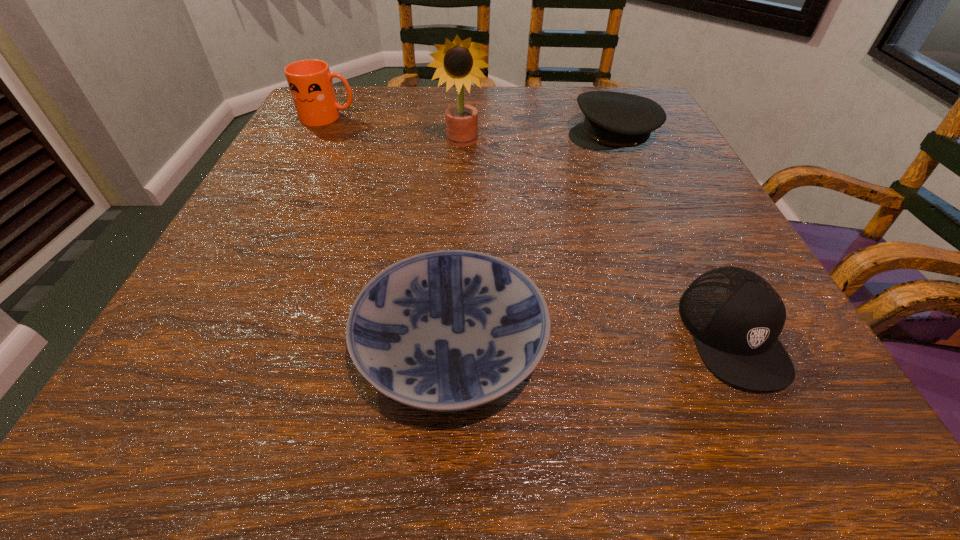
What are the coordinates of `free spot between the plate and the tallest object` in the screenshot? It's located at (457, 244).

Find the location of a particular element. This screenshot has height=540, width=960. vacant space that is in between the cap and the mug is located at coordinates (531, 226).

Locate an element on the screen. free spot between the shortest object and the second tallest object is located at coordinates (390, 232).

Where is `vacant point located between the sunflower and the cap`? The height and width of the screenshot is (540, 960). vacant point located between the sunflower and the cap is located at coordinates (597, 238).

This screenshot has height=540, width=960. I want to click on free spot between the cap and the plate, so (591, 340).

Where is `empty space between the tallest object and the beret`? empty space between the tallest object and the beret is located at coordinates (538, 139).

At what (x,y) coordinates should I click in order to perform the action: click on free space between the cap and the mug. Please return your answer as a coordinate pair (x, y). Looking at the image, I should click on (531, 226).

Select which object appears as the third closest to the cap. Please provide its 2D coordinates. Your answer should be formatted as a tuple, i.e. [(x, y)], where the tuple contains the x and y coordinates of a point satisfying the conditions above.

[(458, 62)]

Select which object is the third closest to the cap. Please provide its 2D coordinates. Your answer should be formatted as a tuple, i.e. [(x, y)], where the tuple contains the x and y coordinates of a point satisfying the conditions above.

[(458, 62)]

This screenshot has height=540, width=960. I want to click on free location that satisfies the following two spatial constraints: 1. on the handle side of the mug; 2. on the left side of the shortest object, so click(212, 346).